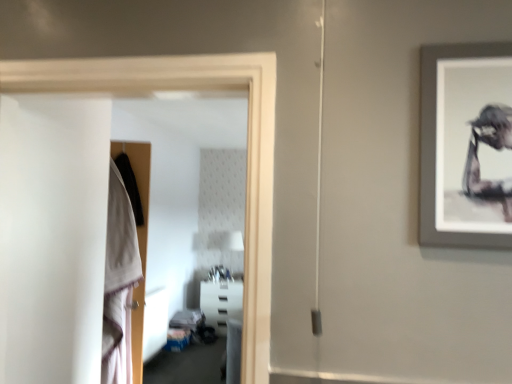
Question: Can you confirm if white cotton robe at left is thinner than transparent glass door at left?

Choices:
 (A) yes
 (B) no

Answer: (B)

Question: Does white cotton robe at left appear on the right side of transparent glass door at left?

Choices:
 (A) yes
 (B) no

Answer: (B)

Question: From a real-world perspective, does white cotton robe at left sit lower than transparent glass door at left?

Choices:
 (A) no
 (B) yes

Answer: (B)

Question: From the image's perspective, is white cotton robe at left located above transparent glass door at left?

Choices:
 (A) no
 (B) yes

Answer: (A)

Question: From the image's perspective, is white cotton robe at left beneath transparent glass door at left?

Choices:
 (A) no
 (B) yes

Answer: (B)

Question: Is white cotton robe at left far away from transparent glass door at left?

Choices:
 (A) no
 (B) yes

Answer: (B)

Question: Is white plastic shelf at center with white cotton robe at left?

Choices:
 (A) no
 (B) yes

Answer: (A)

Question: From the image's perspective, is white plastic shelf at center below white cotton robe at left?

Choices:
 (A) no
 (B) yes

Answer: (B)

Question: Does white plastic shelf at center have a lesser height compared to white cotton robe at left?

Choices:
 (A) no
 (B) yes

Answer: (B)

Question: Is white plastic shelf at center smaller than white cotton robe at left?

Choices:
 (A) yes
 (B) no

Answer: (B)

Question: From a real-world perspective, is white plastic shelf at center below white cotton robe at left?

Choices:
 (A) yes
 (B) no

Answer: (A)

Question: Is white plastic shelf at center not near white cotton robe at left?

Choices:
 (A) yes
 (B) no

Answer: (A)

Question: Could you tell me if white plastic shelf at center is turned towards transparent glass door at left?

Choices:
 (A) no
 (B) yes

Answer: (B)